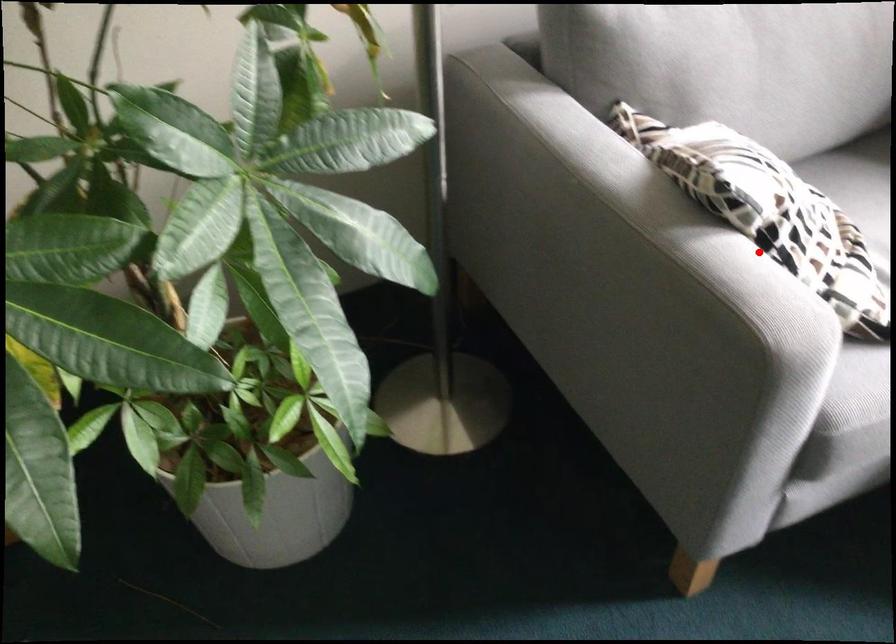
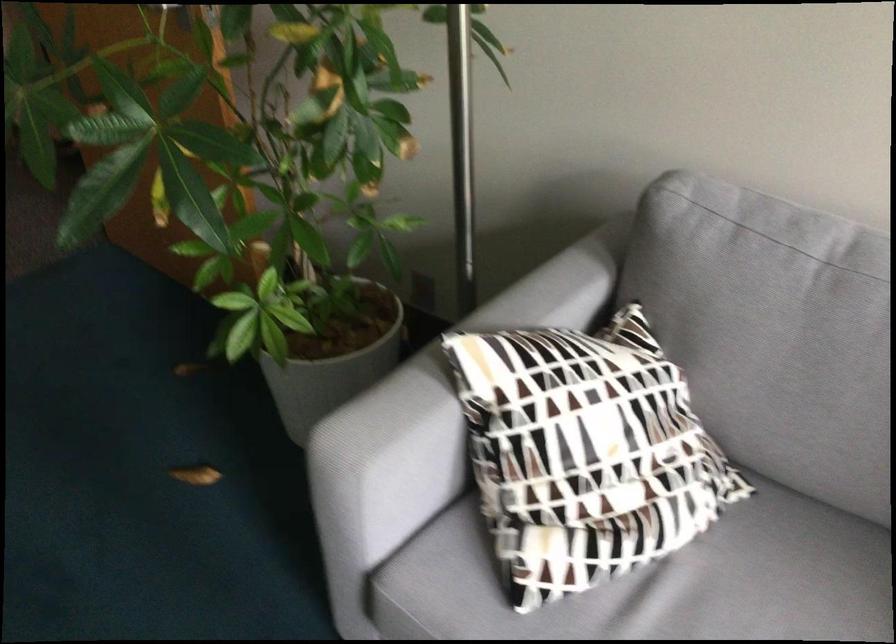
In the second image, find the point that corresponds to the highlighted location in the first image.

(444, 397)